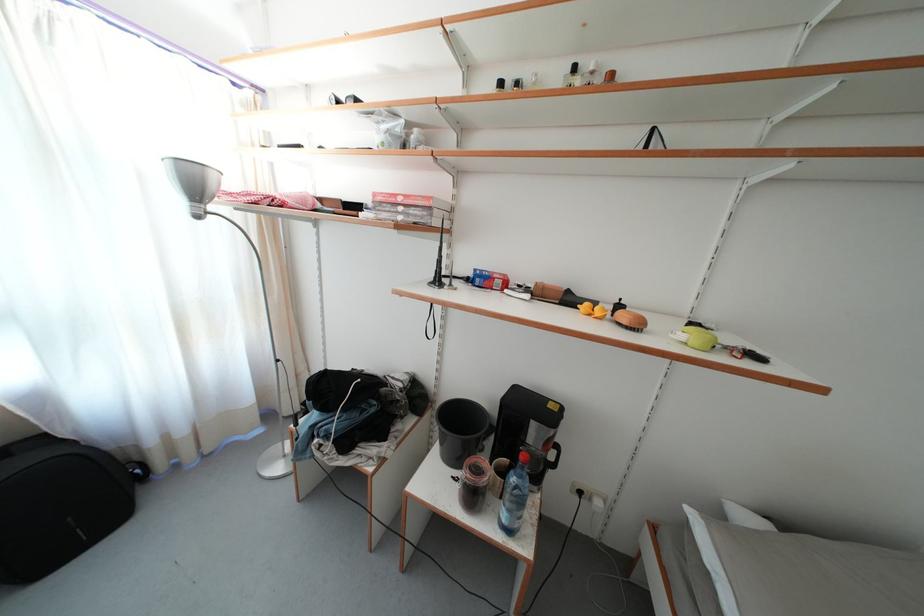
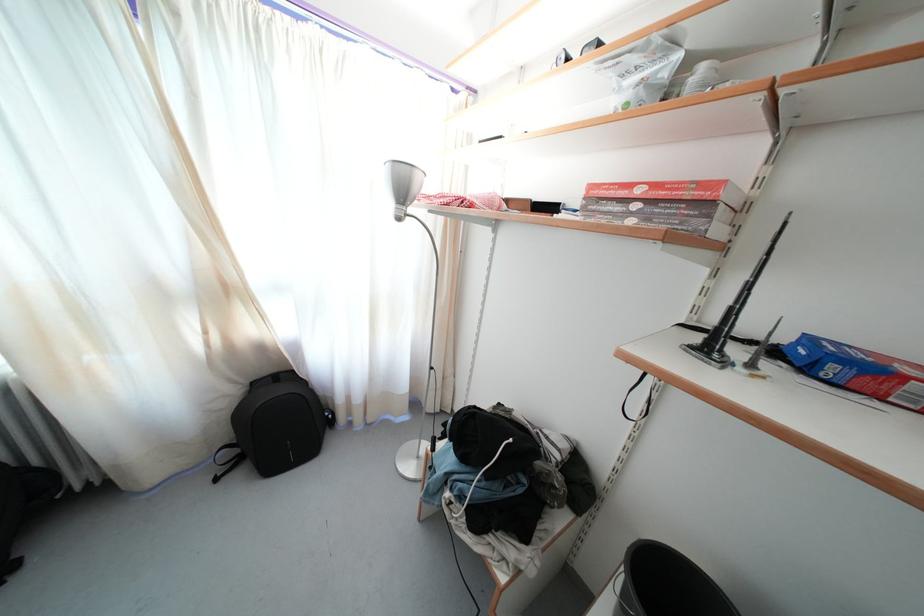
Find the pixel in the second image that matches (x=395, y=145) in the first image.

(649, 100)